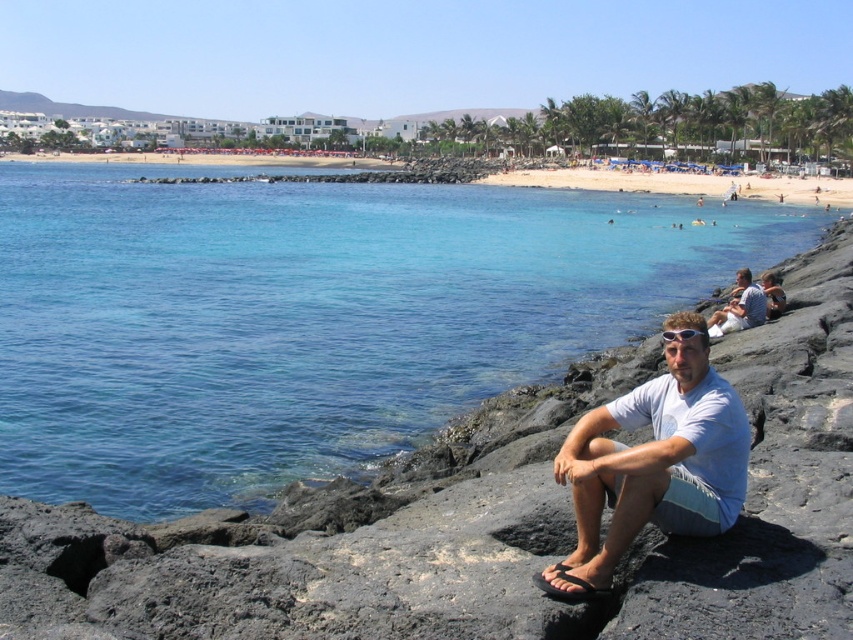
Where is `clear blue water at center`? The height and width of the screenshot is (640, 853). clear blue water at center is located at coordinates (310, 317).

Does point (88, 451) come behind point (735, 296)?

No, it is in front of (735, 296).

At what (x,y) coordinates should I click in order to perform the action: click on clear blue water at center. Please return your answer as a coordinate pair (x, y). Looking at the image, I should click on (310, 317).

Is white cotton shirt at center below white cotton shirt at lower right?

Yes, white cotton shirt at center is below white cotton shirt at lower right.

Does white cotton shirt at center have a greater width compared to white cotton shirt at lower right?

Correct, the width of white cotton shirt at center exceeds that of white cotton shirt at lower right.

Which is in front, point (601, 413) or point (755, 292)?

Positioned in front is point (601, 413).

Image resolution: width=853 pixels, height=640 pixels. In order to click on white cotton shirt at center in this screenshot , I will do `click(653, 467)`.

Does point (21, 214) come farther from viewer compared to point (689, 488)?

Yes, it is.

Is clear blue water at center closer to the viewer compared to white cotton shirt at center?

No, it is not.

Who is more distant from viewer, (363, 413) or (633, 522)?

The point (363, 413) is more distant.

Find the location of a particular element. This screenshot has width=853, height=640. clear blue water at center is located at coordinates (310, 317).